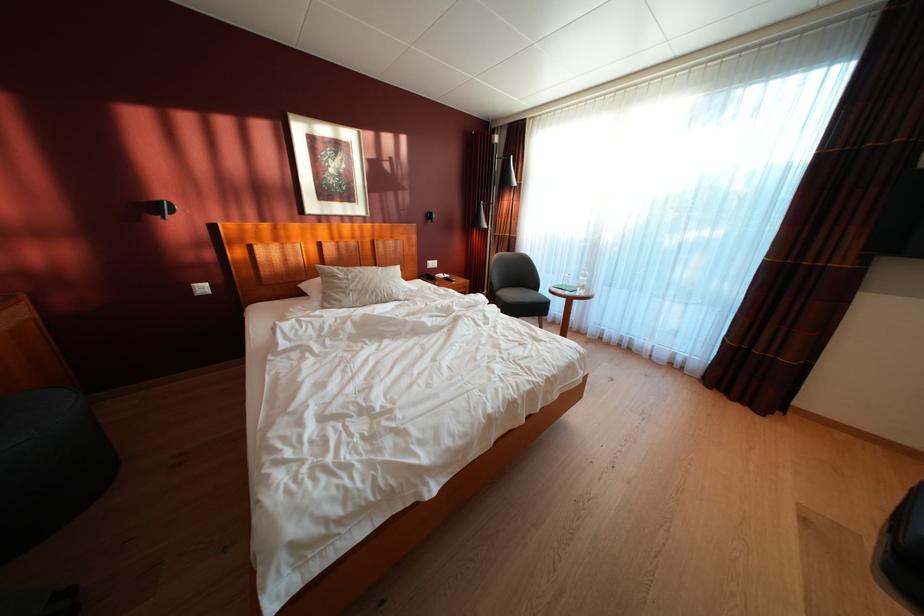
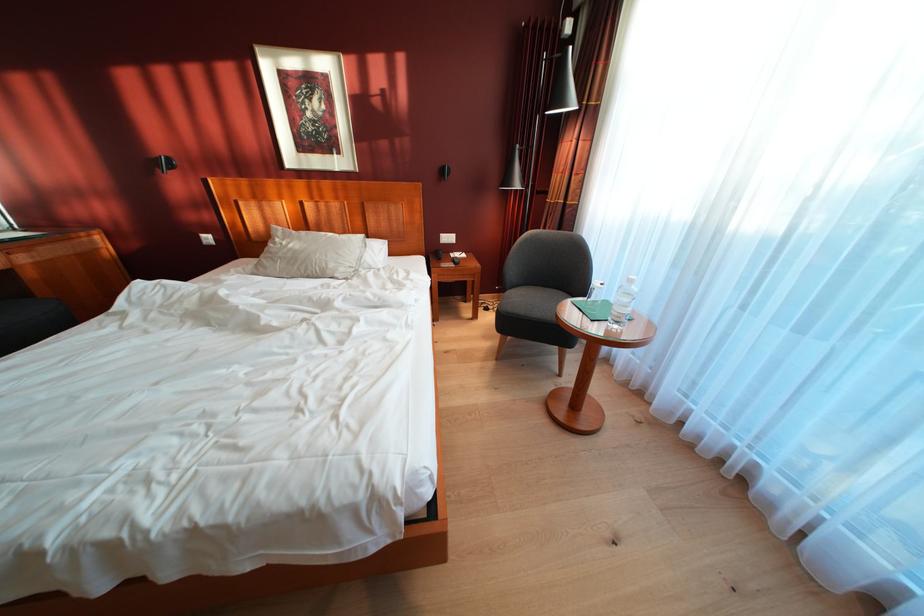
Find the pixel in the second image that matches point 403,302 in the first image.

(336, 278)